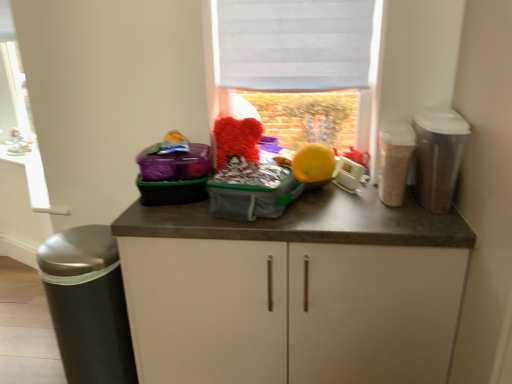
The width and height of the screenshot is (512, 384). In order to click on free location to the left of translucent plastic container at right, placed as the 2th appliance when sorted from left to right in this screenshot , I will do `click(344, 206)`.